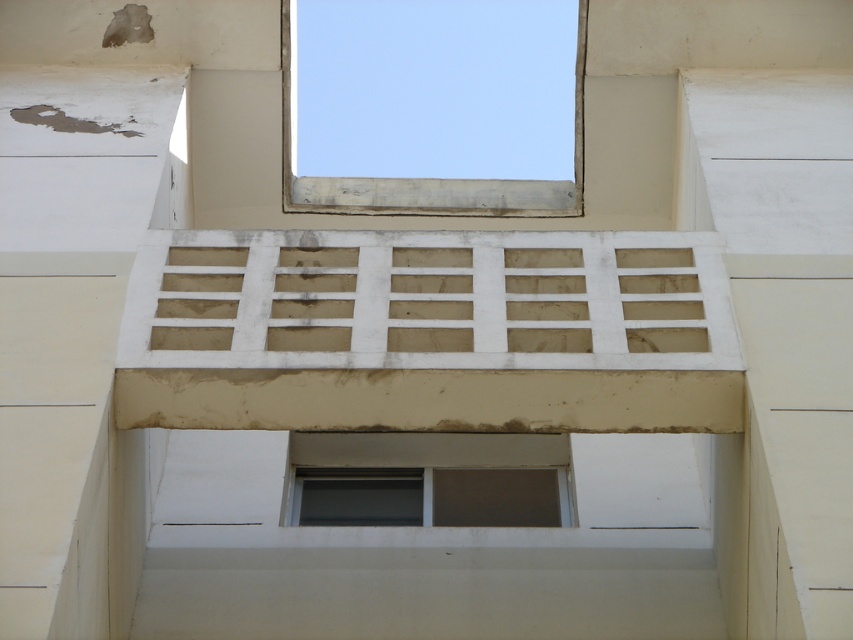
You are a window installer assessing the building exterior. You need to replace the clear glass window at upper center and the matte gray window at center. Which window requires a longer frame to accommodate its height?

The clear glass window at upper center requires a longer frame because it is much taller than the matte gray window at center.

From the picture: You are a window installer assessing the building exterior. You need to determine if the clear glass window at upper center can accommodate a new wider window frame than the matte gray window at center. Based on their current widths, what is your assessment?

The clear glass window at upper center might be wider than the matte gray window at center, so it could potentially accommodate a wider frame. However, further measurements would be needed to confirm.

You are an architect inspecting the building facade. You need to determine which window, the clear glass window at upper center or the matte gray window at center, allows more natural light into the room. Based on their sizes, which one would you expect to let in more light?

The clear glass window at upper center has a larger size compared to the matte gray window at center, so it would allow more natural light into the room.